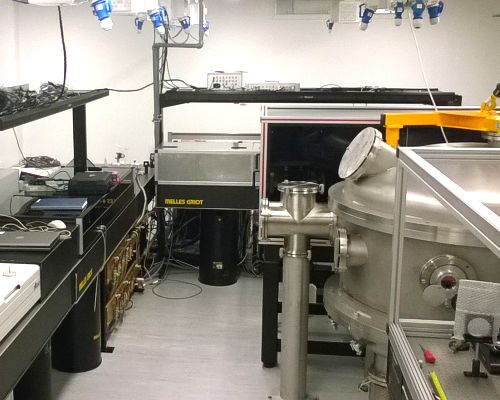
Locate an element on the screen. The image size is (500, 400). white wall is located at coordinates (125, 139).